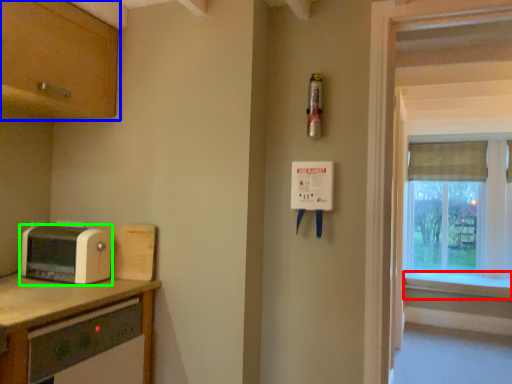
Question: Which object is positioned closest to window sill (highlighted by a red box)? Select from cabinetry (highlighted by a blue box) and toaster (highlighted by a green box).

Choices:
 (A) cabinetry
 (B) toaster

Answer: (B)